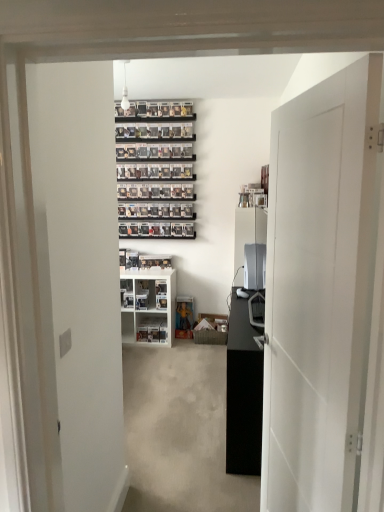
Question: Is white plastic shelf at center, acting as the first shelf starting from the top, looking in the opposite direction of white plastic shelf at center, placed as the 2th shelf when sorted from top to bottom?

Choices:
 (A) yes
 (B) no

Answer: (A)

Question: From a real-world perspective, is white plastic shelf at center, which is the 2th shelf from bottom to top, located higher than white plastic shelf at center, arranged as the first shelf when ordered from the bottom?

Choices:
 (A) yes
 (B) no

Answer: (A)

Question: Considering the relative sizes of white plastic shelf at center, which is the 2th shelf from bottom to top, and white plastic shelf at center, arranged as the first shelf when ordered from the bottom, in the image provided, is white plastic shelf at center, which is the 2th shelf from bottom to top, wider than white plastic shelf at center, arranged as the first shelf when ordered from the bottom,?

Choices:
 (A) no
 (B) yes

Answer: (B)

Question: Is white plastic shelf at center, placed as the 2th shelf when sorted from top to bottom, located within white plastic shelf at center, which is the 2th shelf from bottom to top?

Choices:
 (A) yes
 (B) no

Answer: (A)

Question: Is white plastic shelf at center, acting as the first shelf starting from the top, positioned in front of white plastic shelf at center, placed as the 2th shelf when sorted from top to bottom?

Choices:
 (A) yes
 (B) no

Answer: (A)

Question: Is white plastic shelf at center, which is the 2th shelf from bottom to top, aimed at white plastic shelf at center, arranged as the first shelf when ordered from the bottom?

Choices:
 (A) no
 (B) yes

Answer: (A)

Question: Is black matte cabinet at center positioned beyond the bounds of white matte door at right?

Choices:
 (A) yes
 (B) no

Answer: (A)

Question: From a real-world perspective, is black matte cabinet at center on top of white matte door at right?

Choices:
 (A) no
 (B) yes

Answer: (A)

Question: Does black matte cabinet at center have a greater height compared to white matte door at right?

Choices:
 (A) yes
 (B) no

Answer: (B)

Question: Is black matte cabinet at center far away from white matte door at right?

Choices:
 (A) no
 (B) yes

Answer: (A)

Question: Is black matte cabinet at center at the right side of white matte door at right?

Choices:
 (A) yes
 (B) no

Answer: (A)

Question: From a real-world perspective, is black matte cabinet at center under white matte door at right?

Choices:
 (A) yes
 (B) no

Answer: (A)

Question: Does white plastic shelf at center, arranged as the first shelf when ordered from the bottom, have a lesser width compared to black matte cabinet at center?

Choices:
 (A) yes
 (B) no

Answer: (B)